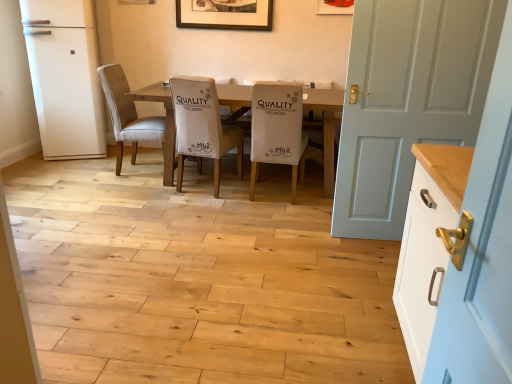
Question: In terms of height, does white painted wood door at right look taller or shorter compared to wooden picture frame at upper center, the 2th picture frame from the front?

Choices:
 (A) short
 (B) tall

Answer: (B)

Question: Is white painted wood door at right in front of or behind wooden picture frame at upper center, which ranks as the 2th picture frame in right-to-left order, in the image?

Choices:
 (A) front
 (B) behind

Answer: (A)

Question: Estimate the real-world distances between objects in this image. Which object is farther from the matte white picture frame at upper center, the first picture frame when ordered from front to back?

Choices:
 (A) wooden picture frame at upper center, positioned as the first picture frame in left-to-right order
 (B) white fabric chair at center, which appears as the second chair when viewed from the right
 (C) white matte refrigerator at left
 (D) suede beige chair at center, the 3th chair in the right-to-left sequence
 (E) white painted wood door at right

Answer: (C)

Question: Which of these objects is positioned closest to the white fabric chair at center, which is the 2th chair from left to right?

Choices:
 (A) wooden table at center
 (B) matte white picture frame at upper center, the first picture frame when ordered from front to back
 (C) white painted wood door at right
 (D) white painted wood cabinet at right
 (E) wooden picture frame at upper center, which ranks as the 2th picture frame in right-to-left order

Answer: (A)